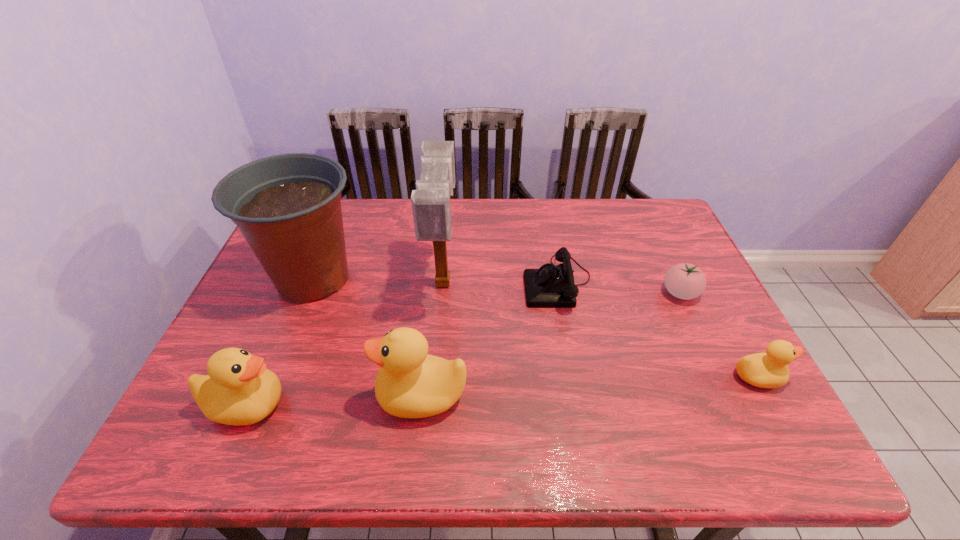
Choose which duck is the second nearest neighbor to the second duck from left to right. Please provide its 2D coordinates. Your answer should be formatted as a tuple, i.e. [(x, y)], where the tuple contains the x and y coordinates of a point satisfying the conditions above.

[(764, 370)]